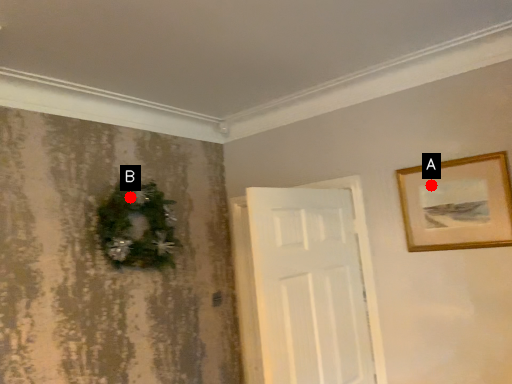
Question: Two points are circled on the image, labeled by A and B beside each circle. Which point is farther from the camera taking this photo?

Choices:
 (A) A is further
 (B) B is further

Answer: (B)